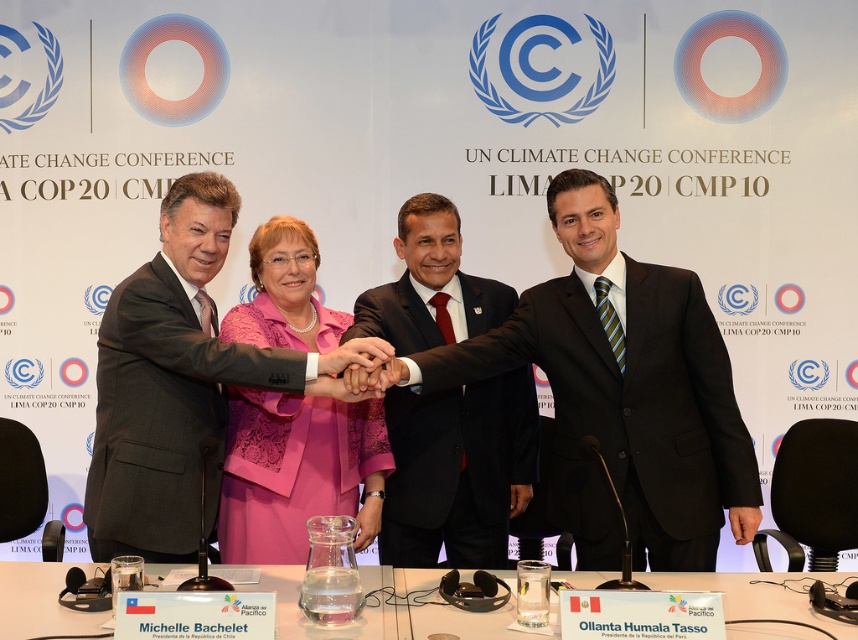
Measure the distance between matte black suit at center and smooth skin hand at center.

matte black suit at center is 24.78 inches from smooth skin hand at center.

Can you confirm if matte black suit at center is positioned to the right of smooth skin hand at center?

Correct, you'll find matte black suit at center to the right of smooth skin hand at center.

At what (x,y) coordinates should I click in order to perform the action: click on matte black suit at center. Please return your answer as a coordinate pair (x, y). This screenshot has width=858, height=640. Looking at the image, I should click on (624, 394).

This screenshot has height=640, width=858. In order to click on pink lace dress at center in this screenshot , I will do `click(297, 472)`.

The width and height of the screenshot is (858, 640). What do you see at coordinates (297, 472) in the screenshot?
I see `pink lace dress at center` at bounding box center [297, 472].

Identify the location of pink lace dress at center. The image size is (858, 640). (297, 472).

Which is behind, point (412, 512) or point (384, 353)?

Positioned behind is point (412, 512).

Does point (437, 449) lie in front of point (384, 349)?

No, it is behind (384, 349).

Who is more forward, [458,280] or [369,339]?

Point [369,339] is more forward.

I want to click on black suit at center, so click(x=458, y=472).